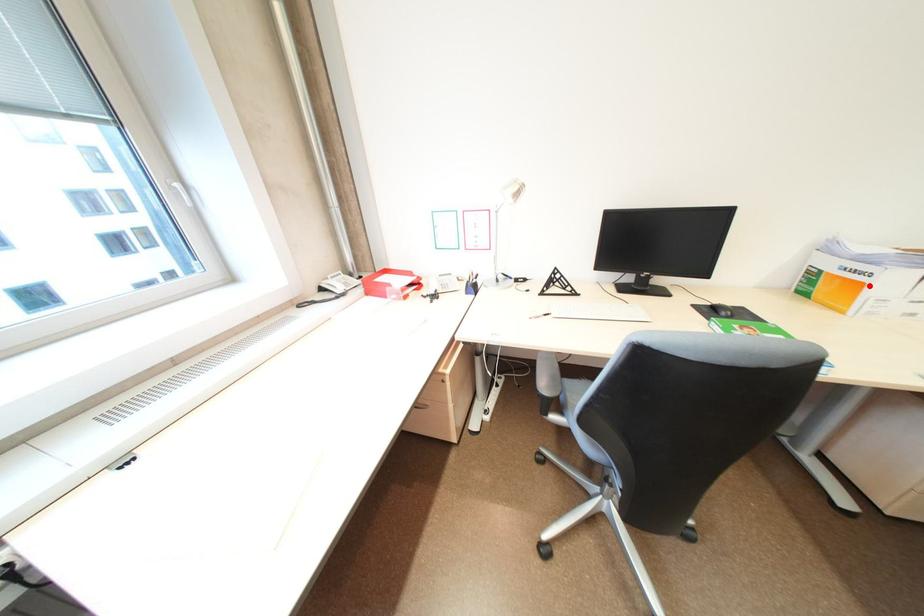
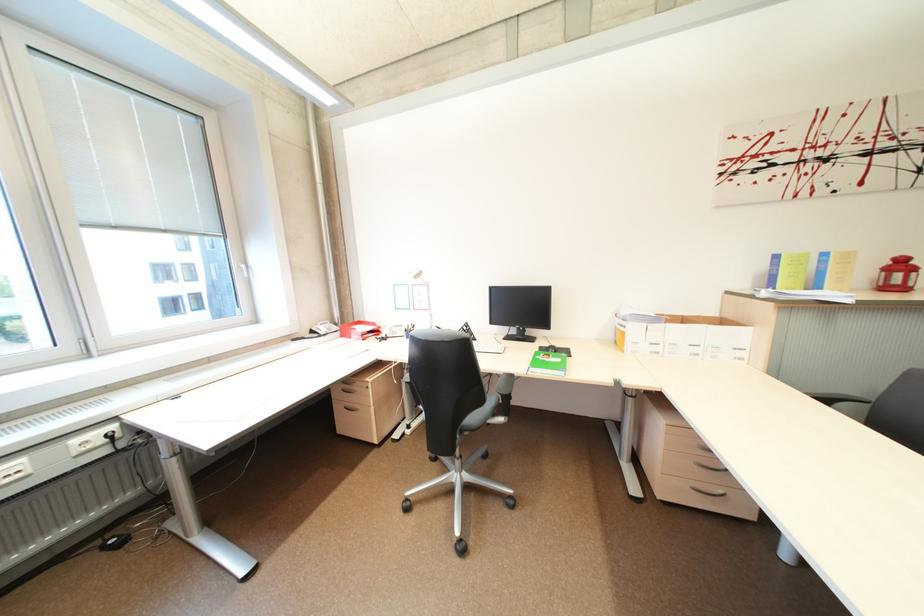
Question: I am providing you with two images of the same scene from different viewpoints. A red point is marked on the first image. At the location where the point appears in image 1, is it still visible in image 2?

Choices:
 (A) Yes
 (B) No

Answer: (A)